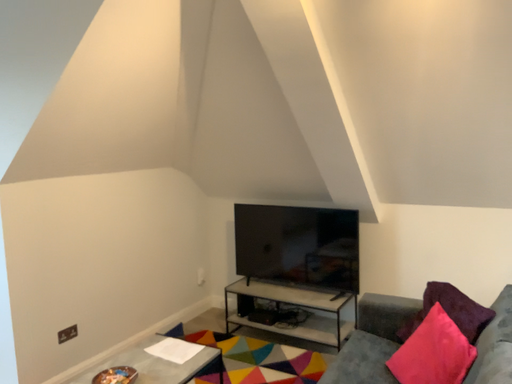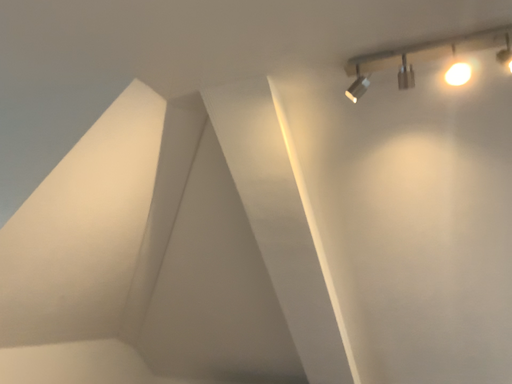
Question: Which way did the camera rotate in the video?

Choices:
 (A) rotated downward
 (B) rotated upward

Answer: (B)